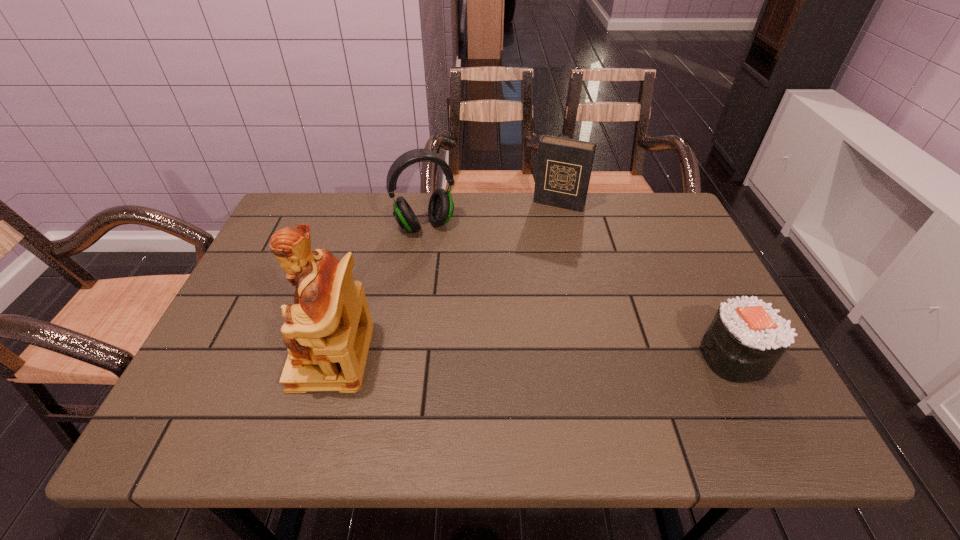
Locate an element on the screen. Image resolution: width=960 pixels, height=540 pixels. free point located on the ear cups of the headset is located at coordinates (483, 339).

Find the location of a particular element. free location located 0.170m on the ear cups of the headset is located at coordinates (453, 278).

Locate an element on the screen. free space located 0.300m on the front cover of the diary is located at coordinates (524, 275).

At what (x,y) coordinates should I click in order to perform the action: click on vacant space located on the front cover of the diary. Please return your answer as a coordinate pair (x, y). Looking at the image, I should click on (527, 271).

Find the location of `vacant space situated on the front cover of the diary`. vacant space situated on the front cover of the diary is located at coordinates [x=524, y=275].

What are the coordinates of `headset that is positioned at the far edge` in the screenshot? It's located at (440, 209).

Identify the location of diary positioned at the far edge. 564,166.

The height and width of the screenshot is (540, 960). What are the coordinates of `figurine that is at the near edge` in the screenshot? It's located at (328, 329).

I want to click on sushi located in the near edge section of the desktop, so click(x=746, y=338).

Identify the location of object at the right edge. Image resolution: width=960 pixels, height=540 pixels. (746, 338).